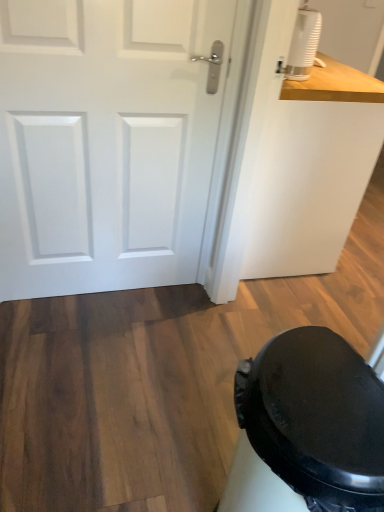
Question: Considering the relative positions of black matte potty at lower right and white matte door at upper left in the image provided, is black matte potty at lower right in front of white matte door at upper left?

Choices:
 (A) no
 (B) yes

Answer: (B)

Question: Is black matte potty at lower right bigger than white matte door at upper left?

Choices:
 (A) no
 (B) yes

Answer: (B)

Question: From the image's perspective, would you say black matte potty at lower right is positioned over white matte door at upper left?

Choices:
 (A) no
 (B) yes

Answer: (A)

Question: From the image's perspective, would you say black matte potty at lower right is shown under white matte door at upper left?

Choices:
 (A) yes
 (B) no

Answer: (A)

Question: Would you consider black matte potty at lower right to be distant from white matte door at upper left?

Choices:
 (A) no
 (B) yes

Answer: (B)

Question: Is white matte door at upper left inside black matte potty at lower right?

Choices:
 (A) no
 (B) yes

Answer: (A)

Question: Is black matte potty at lower right wider than white matte humidifier at upper right?

Choices:
 (A) yes
 (B) no

Answer: (A)

Question: Is black matte potty at lower right thinner than white matte humidifier at upper right?

Choices:
 (A) yes
 (B) no

Answer: (B)

Question: Is black matte potty at lower right behind white matte humidifier at upper right?

Choices:
 (A) yes
 (B) no

Answer: (B)

Question: From a real-world perspective, is black matte potty at lower right over white matte humidifier at upper right?

Choices:
 (A) no
 (B) yes

Answer: (A)

Question: Is black matte potty at lower right oriented towards white matte humidifier at upper right?

Choices:
 (A) no
 (B) yes

Answer: (A)

Question: From the image's perspective, is black matte potty at lower right on top of white matte humidifier at upper right?

Choices:
 (A) no
 (B) yes

Answer: (A)

Question: Would you say black matte potty at lower right is part of white matte door at upper left's contents?

Choices:
 (A) no
 (B) yes

Answer: (A)